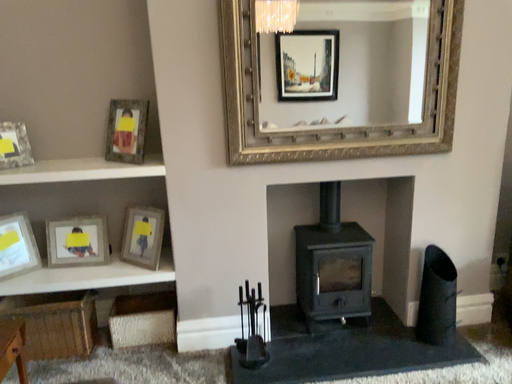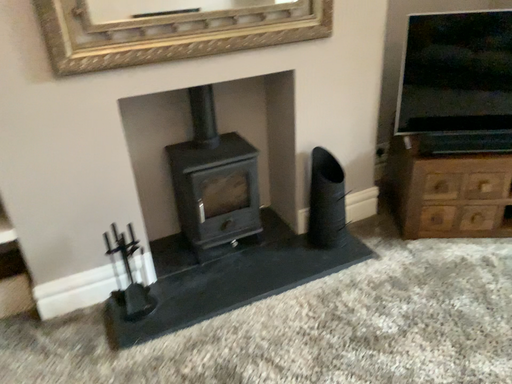
Question: How did the camera likely rotate when shooting the video?

Choices:
 (A) rotated upward
 (B) rotated downward

Answer: (B)